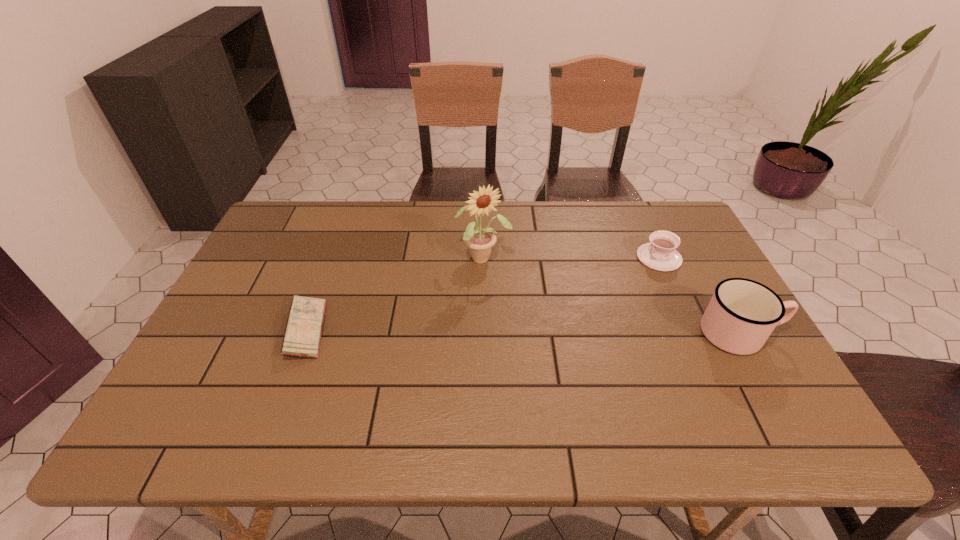
You are a GUI agent. You are given a task and a screenshot of the screen. Output one action in this format:
    pyautogui.click(x=<x>, y=<y>)
    Task: Click on the diary
    
    Given the screenshot: What is the action you would take?
    pyautogui.click(x=302, y=337)

This screenshot has height=540, width=960. What are the coordinates of `the second tallest object` in the screenshot? It's located at (741, 315).

I want to click on sunflower, so click(x=480, y=241).

Where is `the third object from right to left`? the third object from right to left is located at coordinates (480, 241).

Where is `teacup`? This screenshot has width=960, height=540. teacup is located at coordinates (660, 254).

You are a GUI agent. You are given a task and a screenshot of the screen. Output one action in this format:
    pyautogui.click(x=<x>, y=<y>)
    Task: Click on the vacant space located on the back of the leftmost object
    The height and width of the screenshot is (540, 960).
    Given the screenshot: What is the action you would take?
    pyautogui.click(x=340, y=242)

Identify the location of free space located on the front-facing side of the sunflower. (519, 313).

Where is `vacant space located on the front-facing side of the sunflower`? The width and height of the screenshot is (960, 540). vacant space located on the front-facing side of the sunflower is located at coordinates tap(507, 293).

Where is `vacant space located on the front-facing side of the sunflower`? The image size is (960, 540). vacant space located on the front-facing side of the sunflower is located at coordinates 500,281.

Identify the location of vacant region located 0.300m on the handle side of the teacup. (568, 307).